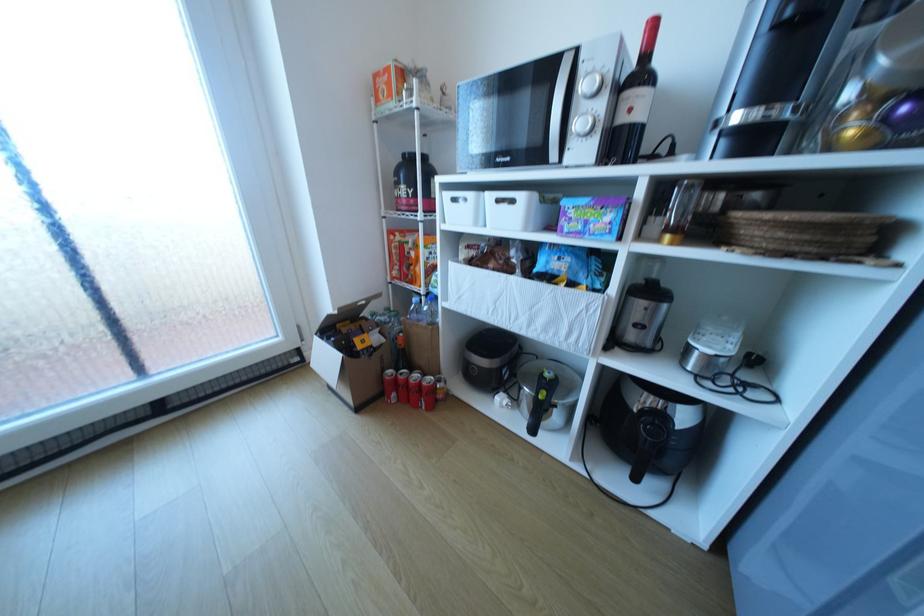
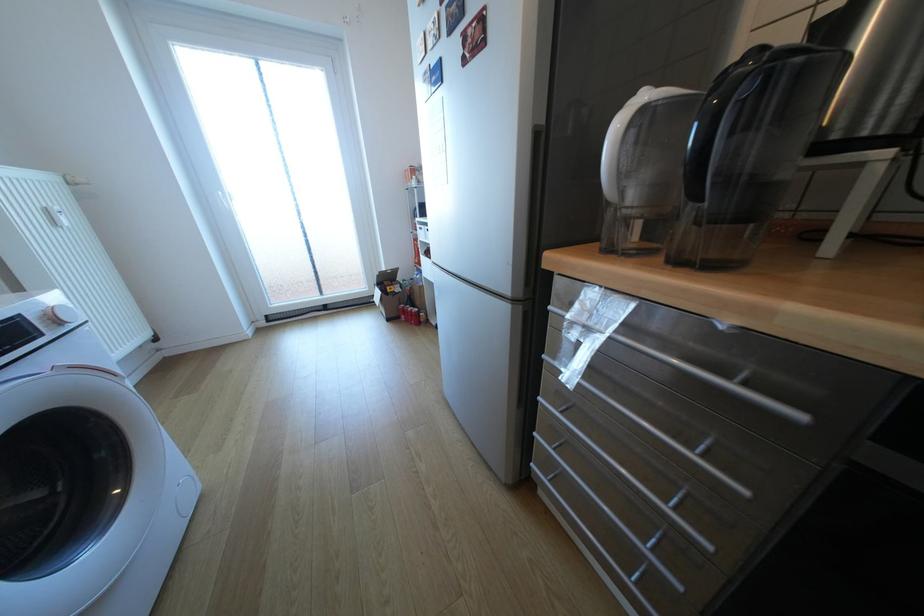
Where in the second image is the point corresponding to point 403,394 from the first image?

(411, 315)